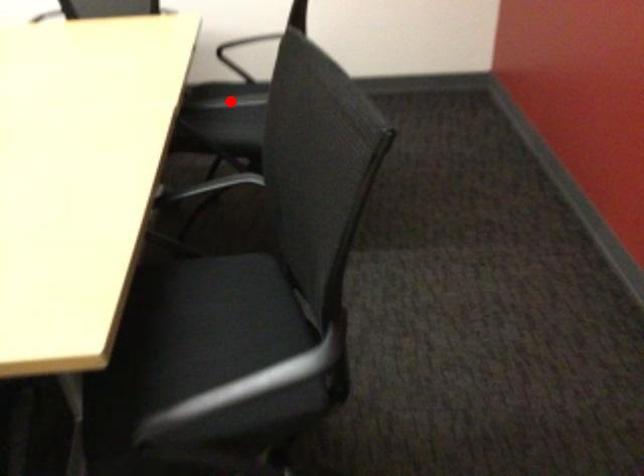
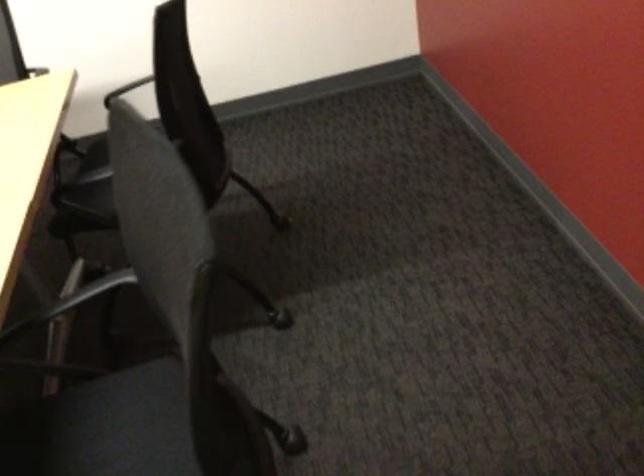
Question: I am providing you with two images of the same scene from different viewpoints. A red point is marked on the first image. Is the red point's position out of view in image 2?

Choices:
 (A) Yes
 (B) No

Answer: (A)